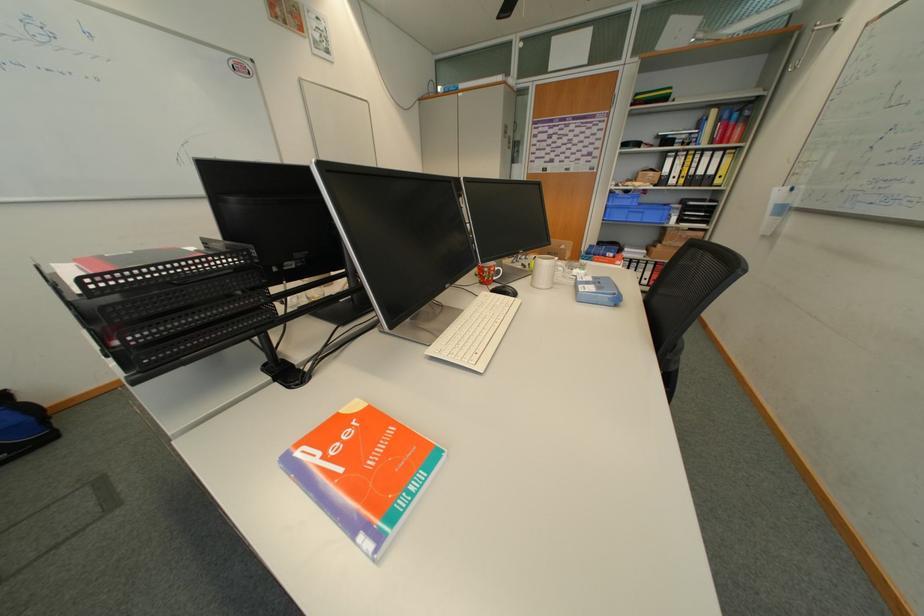
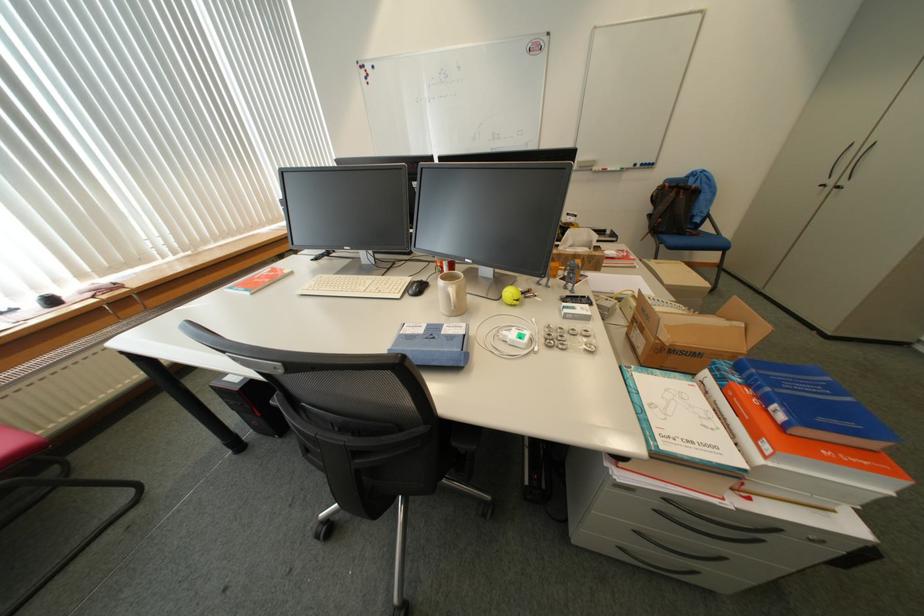
The point at (628, 264) is marked in the first image. Where is the corresponding point in the second image?

(775, 448)